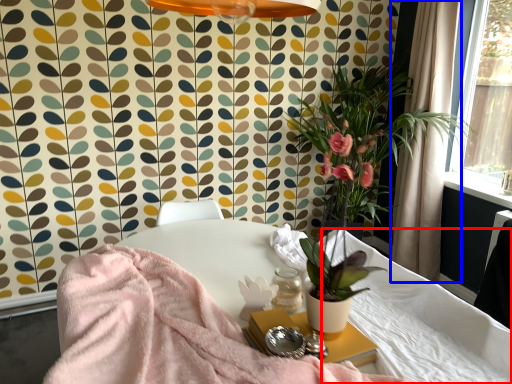
Question: Which of the following is the farthest to the observer, mattress (highlighted by a red box) or curtain (highlighted by a blue box)?

Choices:
 (A) mattress
 (B) curtain

Answer: (B)